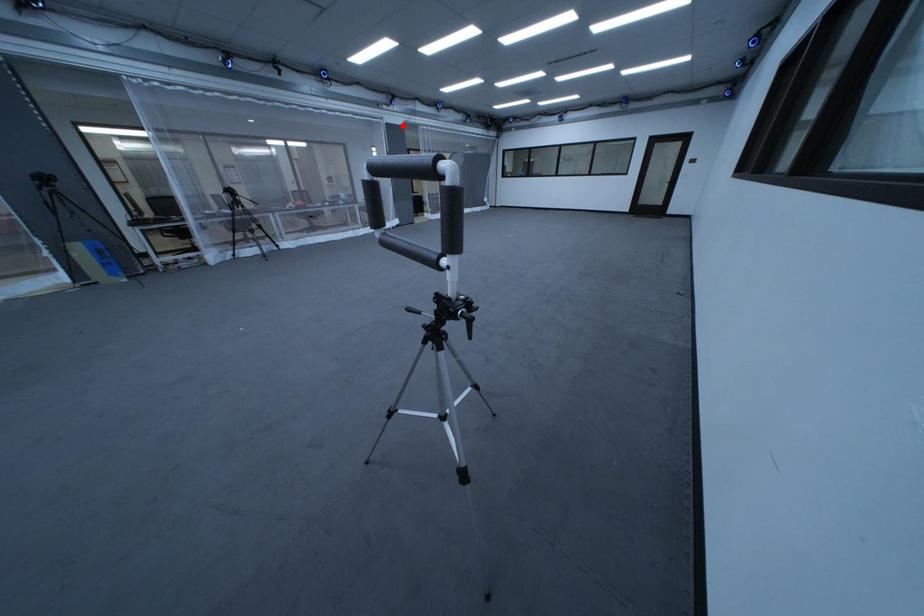
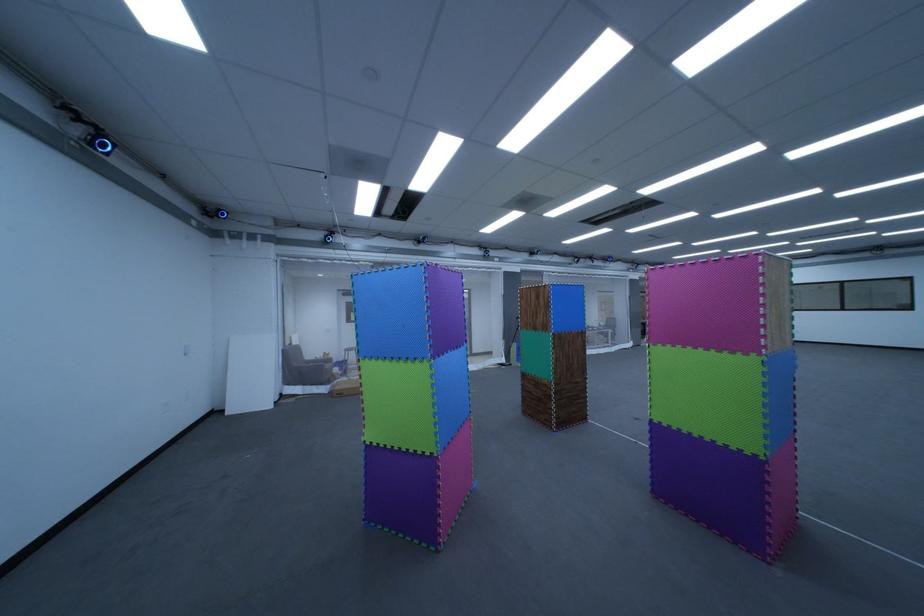
Question: A red point is marked in image1. In image2, is the corresponding 3D point closer to the camera or farther? Reply with the corresponding letter.

Choices:
 (A) The corresponding 3D point is closer.
 (B) The corresponding 3D point is farther.

Answer: (B)